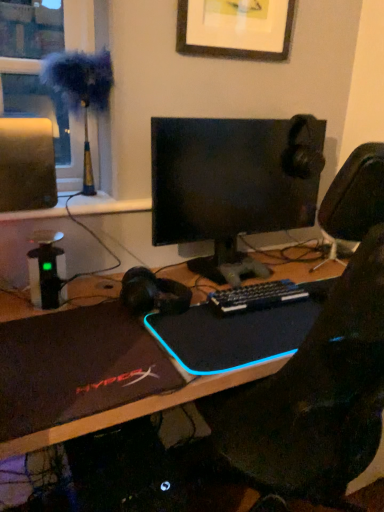
Locate an element on the screen. This screenshot has width=384, height=512. free location above black plastic keyboard at center (from a real-world perspective) is located at coordinates (253, 290).